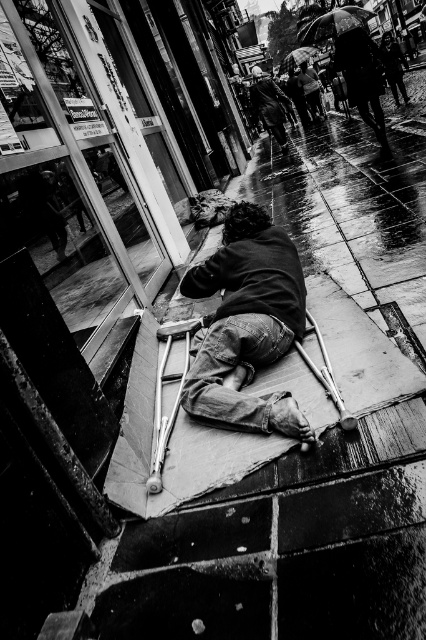
In the scene shown: Looking at the rainy street scene, you notice two umbrellas. The dark fabric umbrella at upper right and the shiny black umbrella at upper center. Which one is shorter in height?

The dark fabric umbrella at upper right is shorter in height compared to the shiny black umbrella at upper center.

You are a photographer trying to capture the reflection in the shop window. You notice two umbrellas at the upper center of the image. Which of the two umbrellas, the black matte umbrella at upper center or the shiny black umbrella at upper center, is taller and would cast a longer shadow in the reflection?

The black matte umbrella at upper center is taller than the shiny black umbrella at upper center, so it would cast a longer shadow in the reflection.